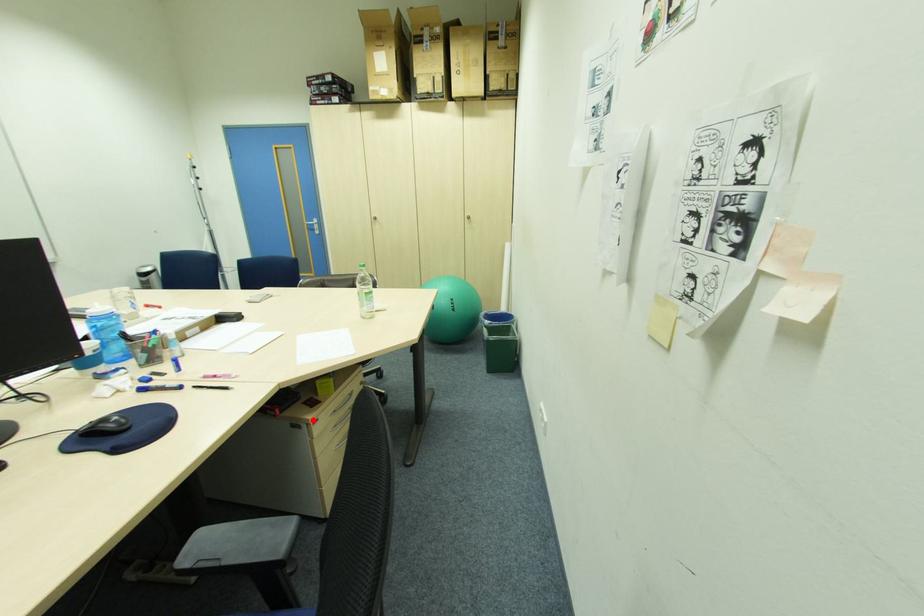
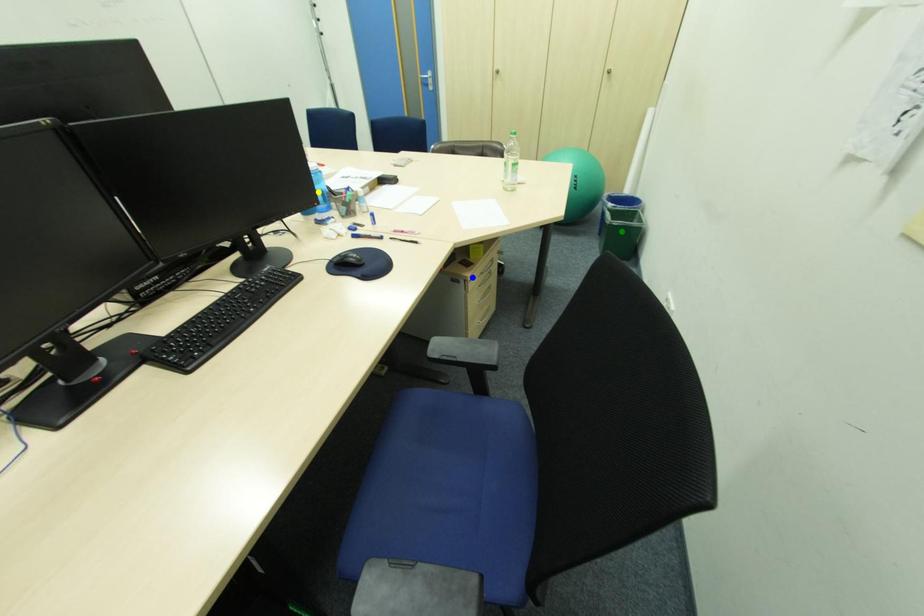
Question: I am providing you with two images of the same scene from different viewpoints. A red point is marked on the first image. You are given multiple points on the second image. In image 2, which mark is for the same physical point as the one in image 1?

Choices:
 (A) yellow point
 (B) green point
 (C) blue point

Answer: (C)